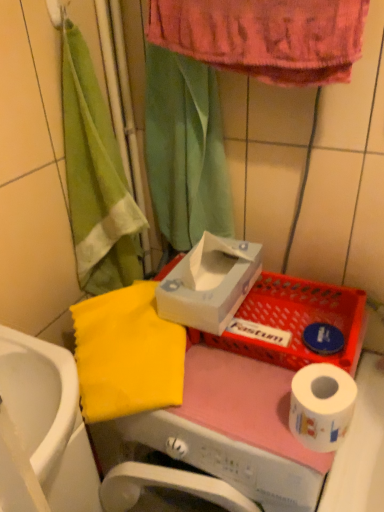
Question: Is white cardboard tissue box at center to the left of yellow fabric at left from the viewer's perspective?

Choices:
 (A) yes
 (B) no

Answer: (B)

Question: Is white cardboard tissue box at center oriented away from yellow fabric at left?

Choices:
 (A) no
 (B) yes

Answer: (A)

Question: Is white cardboard tissue box at center thinner than yellow fabric at left?

Choices:
 (A) yes
 (B) no

Answer: (B)

Question: Is yellow fabric at left a part of white cardboard tissue box at center?

Choices:
 (A) no
 (B) yes

Answer: (A)

Question: Is white cardboard tissue box at center closer to the viewer compared to yellow fabric at left?

Choices:
 (A) yes
 (B) no

Answer: (B)

Question: Is white cardboard tissue box at center smaller than yellow fabric at left?

Choices:
 (A) no
 (B) yes

Answer: (B)

Question: Does green fabric shower curtain at upper center have a larger size compared to white cardboard tissue box at center?

Choices:
 (A) no
 (B) yes

Answer: (B)

Question: From a real-world perspective, is green fabric shower curtain at upper center physically below white cardboard tissue box at center?

Choices:
 (A) yes
 (B) no

Answer: (B)

Question: From the image's perspective, is green fabric shower curtain at upper center on top of white cardboard tissue box at center?

Choices:
 (A) yes
 (B) no

Answer: (A)

Question: Is green fabric shower curtain at upper center oriented towards white cardboard tissue box at center?

Choices:
 (A) no
 (B) yes

Answer: (B)

Question: Is white cardboard tissue box at center surrounded by green fabric shower curtain at upper center?

Choices:
 (A) yes
 (B) no

Answer: (B)

Question: Is green fabric shower curtain at upper center turned away from white cardboard tissue box at center?

Choices:
 (A) no
 (B) yes

Answer: (A)

Question: From the image's perspective, is white glossy sink at lower left above green fabric shower curtain at upper center?

Choices:
 (A) no
 (B) yes

Answer: (A)